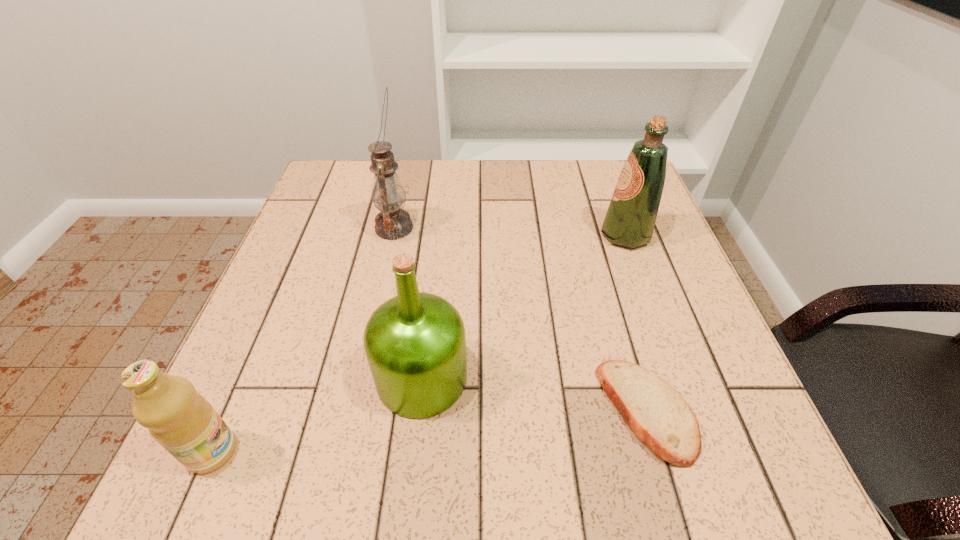
At what (x,y) coordinates should I click in order to perform the action: click on oil lamp. Please return your answer as a coordinate pair (x, y). The image size is (960, 540). Looking at the image, I should click on (388, 194).

Find the location of a particular element. the farthest olive oil is located at coordinates tap(630, 219).

The image size is (960, 540). What are the coordinates of `the second olive oil from left to right` in the screenshot? It's located at (415, 343).

Where is `the nearest olive oil`? The height and width of the screenshot is (540, 960). the nearest olive oil is located at coordinates (181, 420).

In order to click on the leftmost object in this screenshot , I will do (181, 420).

Where is `the shortest object`? Image resolution: width=960 pixels, height=540 pixels. the shortest object is located at coordinates (x=657, y=413).

Identify the location of vacant space located on the back of the oil lamp. Image resolution: width=960 pixels, height=540 pixels. (402, 190).

At what (x,y) coordinates should I click in order to perform the action: click on blank space located 0.130m on the front-facing side of the rightmost olive oil. Please return your answer as a coordinate pair (x, y). The image size is (960, 540). Looking at the image, I should click on (544, 235).

You are a GUI agent. You are given a task and a screenshot of the screen. Output one action in this format:
    pyautogui.click(x=<x>, y=<y>)
    Task: Click on the vacant space situated on the front-facing side of the rightmost olive oil
    
    Given the screenshot: What is the action you would take?
    pyautogui.click(x=532, y=235)

Find the location of a particular element. The image size is (960, 540). vacant point located 0.130m on the front-facing side of the rightmost olive oil is located at coordinates (544, 235).